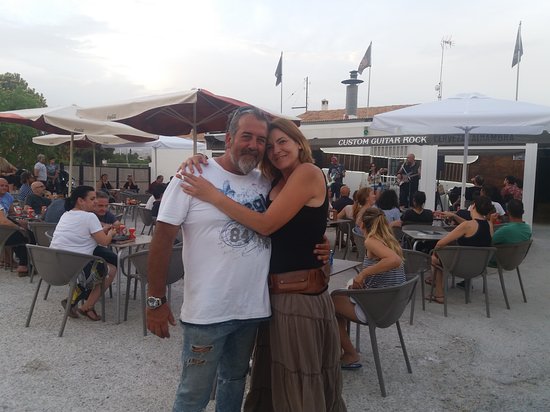
Identify the location of table. Image resolution: width=550 pixels, height=412 pixels. (141, 238), (346, 270), (342, 217), (438, 235), (118, 188).